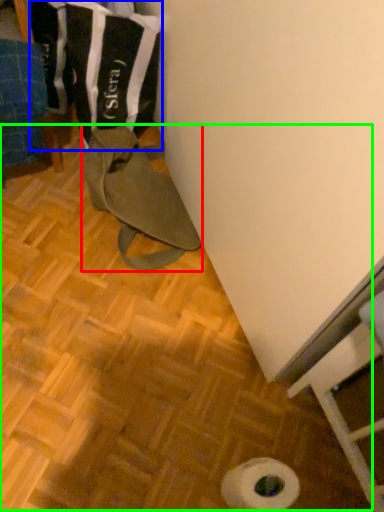
Question: Which object is positioned closest to wide (highlighted by a red box)? Select from laundry (highlighted by a blue box) and wood (highlighted by a green box).

Choices:
 (A) laundry
 (B) wood

Answer: (B)